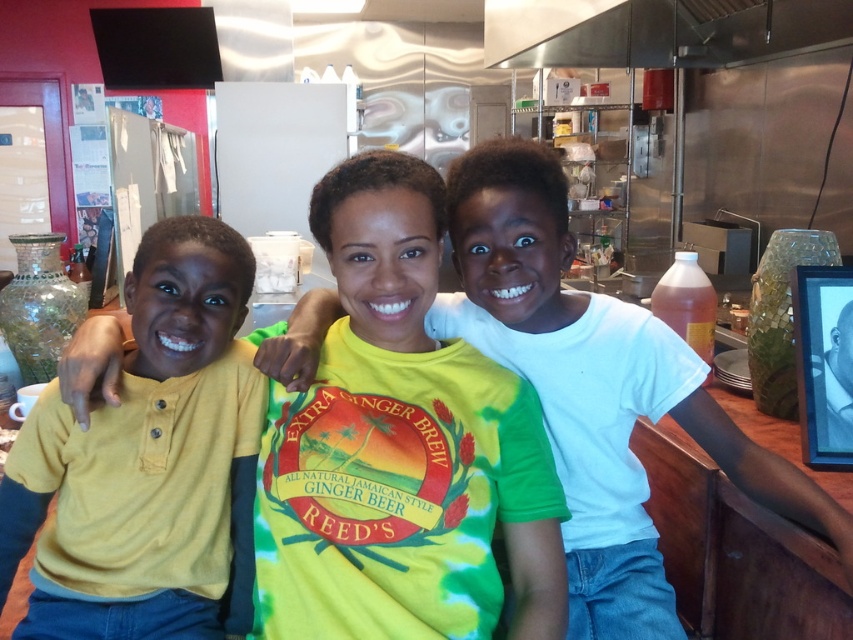
You are standing in the kitchen and want to move from point A to point B. Point A is at coordinates point (817,492) and point B is at coordinates point (672,44). Which point is closer to you when you are facing the kitchen appliances?

Point (817,492) is in front of point (672,44), so when facing the kitchen appliances, point A is closer to you.

You are a photographer setting up a shot in this kitchen scene. You need to ensure that the yellow cotton shirt at left and the stainless steel exhaust hood at upper center are both visible in the frame. Given their sizes, which object might require you to adjust your camera angle to include it fully?

The yellow cotton shirt at left has a smaller size compared to the stainless steel exhaust hood at upper center, so the photographer might need to adjust the camera angle to ensure the larger stainless steel exhaust hood at upper center is fully captured in the frame.